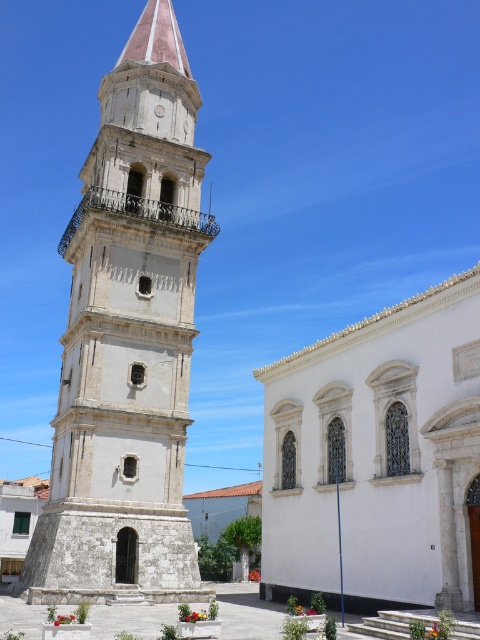
You are a tourist standing in front of the white stone tower at center and the white stone church at center. Which one is positioned higher up in the image?

The white stone tower at center is located above the white stone church at center, so it is positioned higher up in the image.

You are standing at the point marked by coordinate point [128,340]. What is the closest object to you in the image?

The point [128,340] marks the white stone tower at center, so the closest object to you is the white stone tower at center.